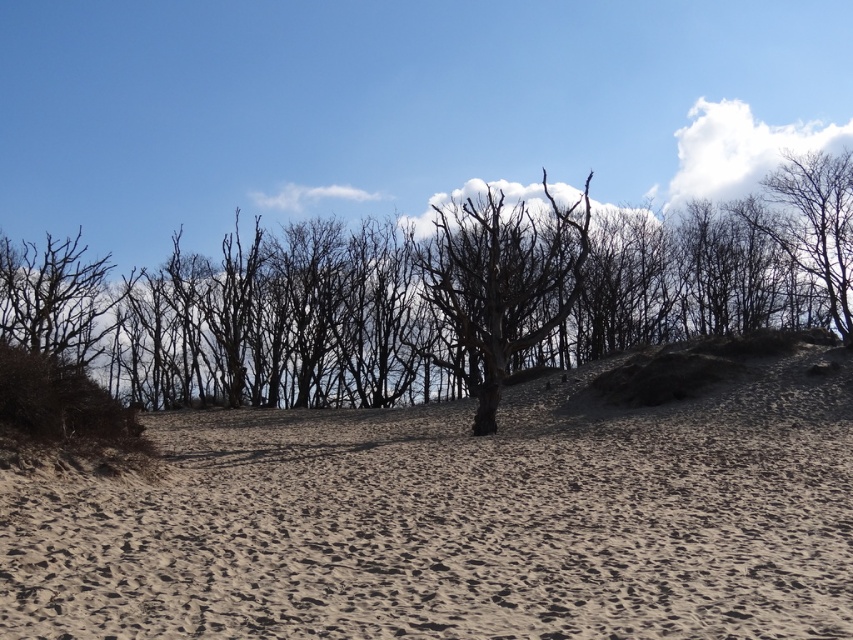
Question: Is smooth beige sand at center to the right of bare branches at center from the viewer's perspective?

Choices:
 (A) no
 (B) yes

Answer: (B)

Question: Which object is closer to the camera taking this photo?

Choices:
 (A) bare branches at center
 (B) bare branches at upper right
 (C) smooth beige sand at center

Answer: (C)

Question: Can you confirm if smooth beige sand at center is smaller than bare wood tree at center?

Choices:
 (A) no
 (B) yes

Answer: (B)

Question: Which is farther from the bare branches at upper right?

Choices:
 (A) bare wood tree at center
 (B) bare branches at center
 (C) smooth beige sand at center

Answer: (C)

Question: Is smooth beige sand at center below bare branches at center?

Choices:
 (A) yes
 (B) no

Answer: (A)

Question: Which of these objects is positioned closest to the bare branches at center?

Choices:
 (A) bare branches at upper right
 (B) bare wood tree at center
 (C) smooth beige sand at center

Answer: (B)